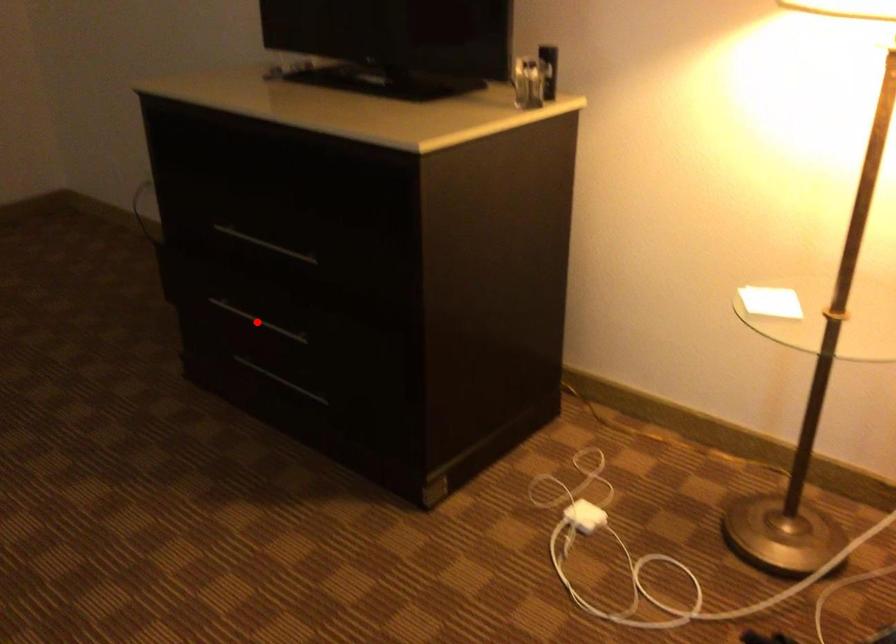
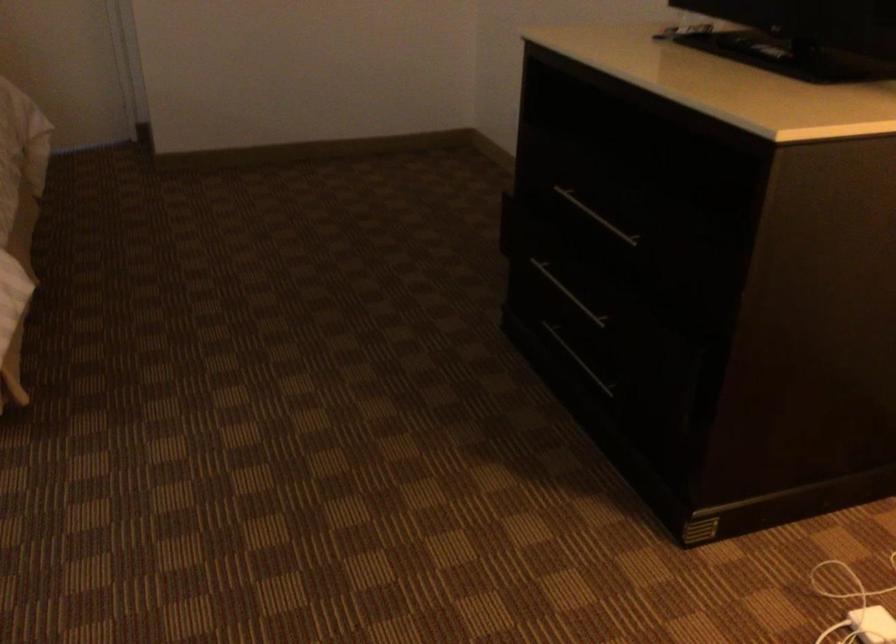
Where in the second image is the point corresponding to the highlighted location from the first image?

(567, 292)